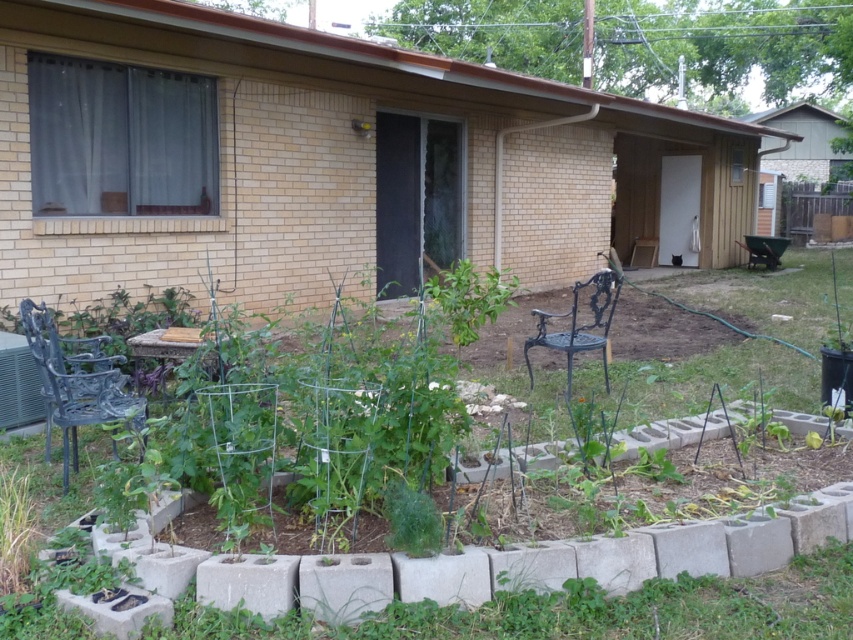
Is point (48, 483) more distant than point (44, 378)?

That is False.

Who is more forward, (778, 484) or (57, 364)?

Point (778, 484) is in front.

Where is `green wire trellis at center`? This screenshot has width=853, height=640. green wire trellis at center is located at coordinates (648, 612).

Between matte black chair at left and black wrought iron chair at center-right, which one appears on the left side from the viewer's perspective?

From the viewer's perspective, matte black chair at left appears more on the left side.

You are a GUI agent. You are given a task and a screenshot of the screen. Output one action in this format:
    pyautogui.click(x=<x>, y=<y>)
    Task: Click on the matte black chair at left
    This screenshot has height=640, width=853.
    Given the screenshot: What is the action you would take?
    pyautogui.click(x=76, y=381)

The height and width of the screenshot is (640, 853). I want to click on matte black chair at left, so click(76, 381).

Is point (543, 536) positioned before point (576, 284)?

Yes, point (543, 536) is in front of point (576, 284).

Is green wire trellis at center in front of black wrought iron chair at center-right?

Yes.

Is point (825, 582) farther from viewer compared to point (569, 336)?

No, it is not.

The height and width of the screenshot is (640, 853). Find the location of `green wire trellis at center`. green wire trellis at center is located at coordinates (648, 612).